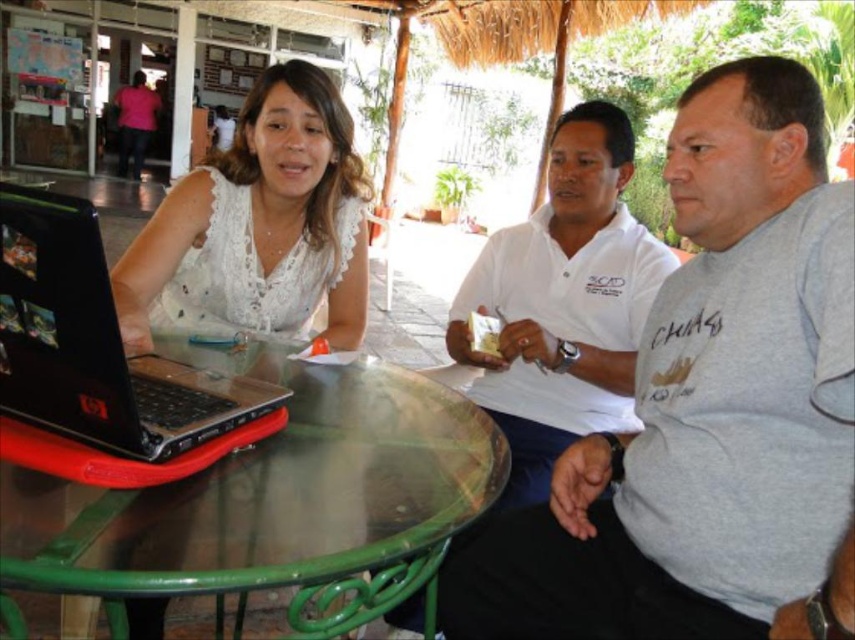
Is gray cotton shirt at center further to camera compared to transparent glass table at center?

Yes.

Does gray cotton shirt at center have a greater width compared to transparent glass table at center?

In fact, gray cotton shirt at center might be narrower than transparent glass table at center.

The image size is (855, 640). Describe the element at coordinates (705, 404) in the screenshot. I see `gray cotton shirt at center` at that location.

At what (x,y) coordinates should I click in order to perform the action: click on gray cotton shirt at center. Please return your answer as a coordinate pair (x, y). This screenshot has width=855, height=640. Looking at the image, I should click on (705, 404).

Between white cotton shirt at center and black plastic laptop at left, which one is positioned higher?

white cotton shirt at center

Who is taller, white cotton shirt at center or black plastic laptop at left?

Standing taller between the two is white cotton shirt at center.

Which is in front, point (549, 321) or point (178, 368)?

Positioned in front is point (178, 368).

Where is `white cotton shirt at center`? white cotton shirt at center is located at coordinates (563, 301).

Is point (845, 406) farther from camera compared to point (576, 147)?

No, (845, 406) is closer to viewer.

Can you confirm if gray cotton shirt at center is positioned to the left of white cotton shirt at center?

In fact, gray cotton shirt at center is to the right of white cotton shirt at center.

Locate an element on the screen. Image resolution: width=855 pixels, height=640 pixels. gray cotton shirt at center is located at coordinates (705, 404).